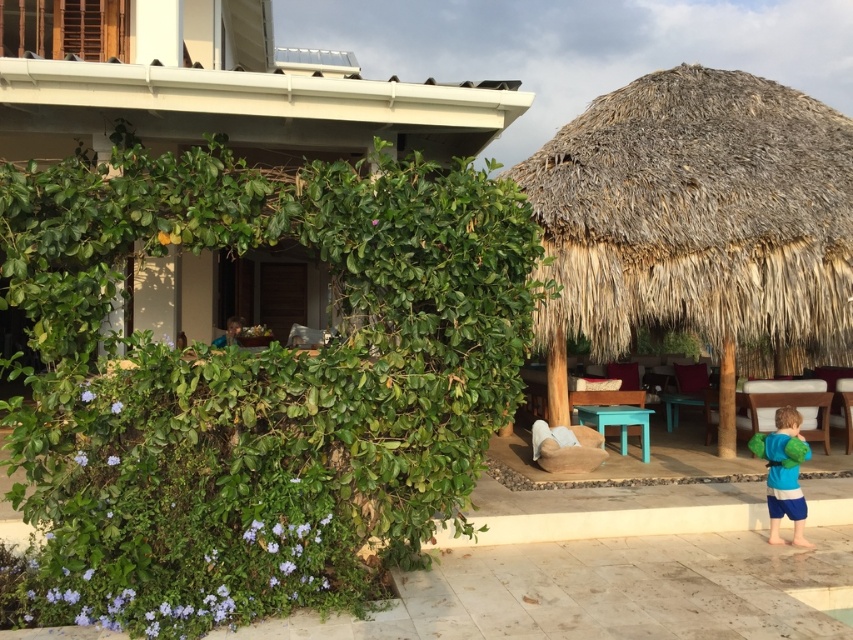
Can you confirm if thatched straw hut at right is wider than blue fleece jacket at lower right?

Indeed, thatched straw hut at right has a greater width compared to blue fleece jacket at lower right.

Which of these two, thatched straw hut at right or blue fleece jacket at lower right, stands taller?

thatched straw hut at right is taller.

Locate an element on the screen. thatched straw hut at right is located at coordinates (694, 220).

Identify the location of thatched straw hut at right. This screenshot has width=853, height=640. (694, 220).